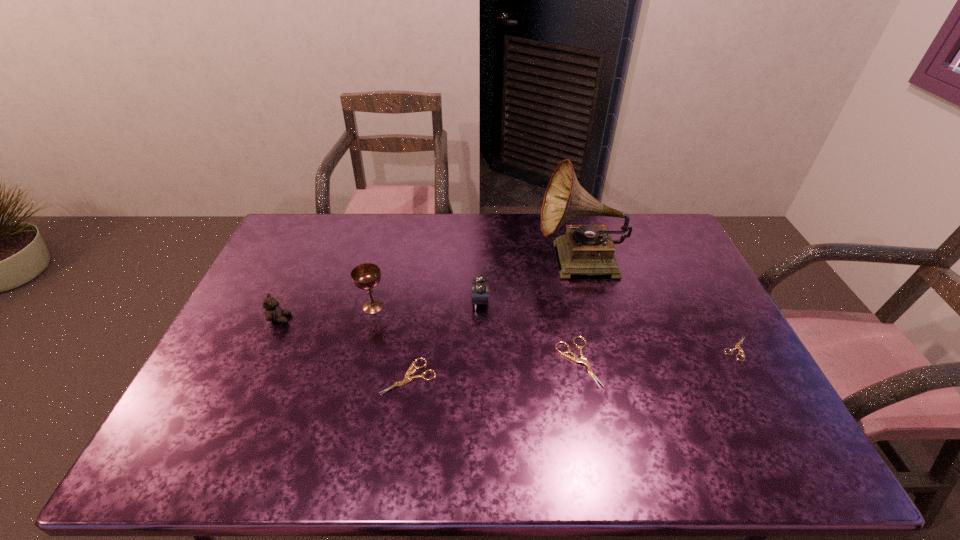
Where is `free region located 0.360m on the front side of the fourth object from left to right`? This screenshot has height=540, width=960. free region located 0.360m on the front side of the fourth object from left to right is located at coordinates (356, 302).

Where is `vacant space located 0.300m on the back of the second tallest object`? This screenshot has height=540, width=960. vacant space located 0.300m on the back of the second tallest object is located at coordinates (390, 239).

The height and width of the screenshot is (540, 960). Find the location of `object that is at the far edge`. object that is at the far edge is located at coordinates (585, 249).

Locate an element on the screen. This screenshot has width=960, height=540. object that is at the near edge is located at coordinates (407, 379).

I want to click on object that is at the left edge, so click(273, 313).

This screenshot has height=540, width=960. I want to click on object located in the right edge section of the desktop, so click(737, 346).

Where is `free space at the far edge of the desktop`? This screenshot has width=960, height=540. free space at the far edge of the desktop is located at coordinates (396, 239).

In the image, there is a desktop. Identify the location of vacant space at the right edge. (654, 275).

In the image, there is a desktop. At what (x,y) coordinates should I click in order to perform the action: click on free space at the far left corner. Please return your answer as a coordinate pair (x, y). This screenshot has height=540, width=960. Looking at the image, I should click on (324, 214).

Identify the location of free space at the far right corner of the desktop. Image resolution: width=960 pixels, height=540 pixels. (634, 214).